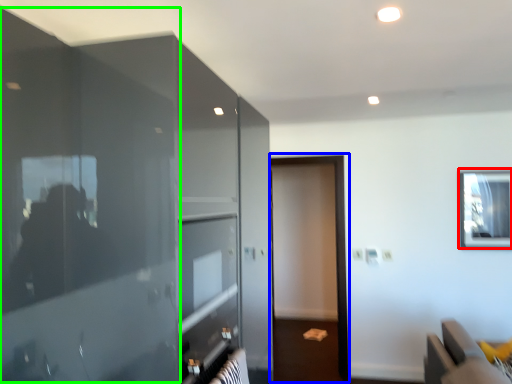
Question: Which object is positioned closest to window (highlighted by a red box)? Select from screen door (highlighted by a blue box) and glass door (highlighted by a green box).

Choices:
 (A) screen door
 (B) glass door

Answer: (A)